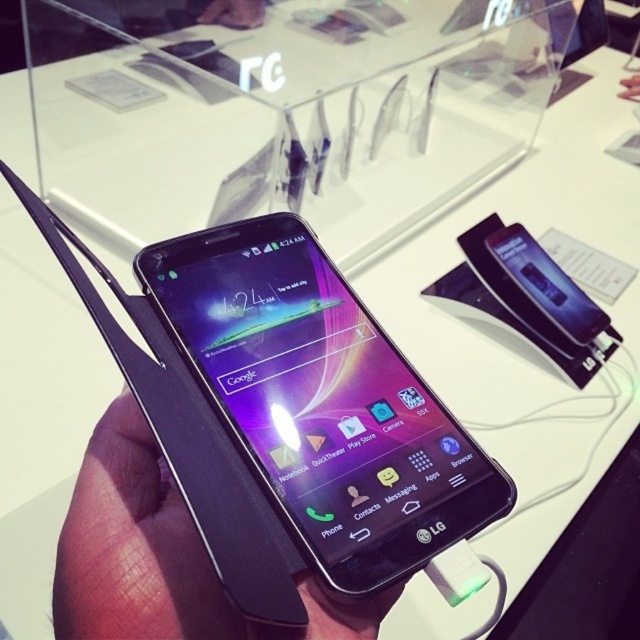
You are trying to decide which phone to buy between the black glossy phone at center and the black matte phone at center. Which one is bigger in size?

The black glossy phone at center is larger in size compared to the black matte phone at center.

Consider the image. You are trying to locate the black glossy phone at center in the image. Given that the coordinate system starts at the bottom left corner of the image with coordinates 0,0, can you determine if the point (321, 401) is to the right or left of the black glossy phone at center?

The point (321, 401) marks the black glossy phone at center, so it is exactly at the position of the phone.